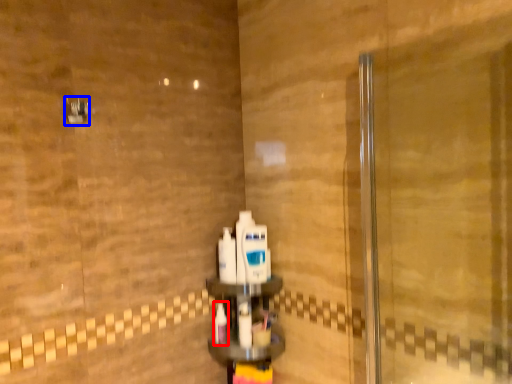
Question: Among these objects, which one is nearest to the camera, toothbrush (highlighted by a red box) or shower (highlighted by a blue box)?

Choices:
 (A) toothbrush
 (B) shower

Answer: (B)